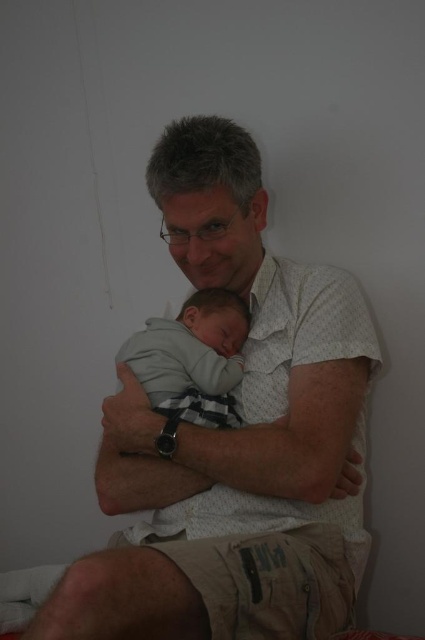
Is white textured shirt at center shorter than gray soft fabric baby at center?

No, white textured shirt at center is not shorter than gray soft fabric baby at center.

Does white textured shirt at center appear over gray soft fabric baby at center?

Actually, white textured shirt at center is below gray soft fabric baby at center.

Is point (249, 236) behind point (209, 406)?

Yes, it is behind point (209, 406).

The image size is (425, 640). In order to click on white textured shirt at center in this screenshot , I will do `click(232, 436)`.